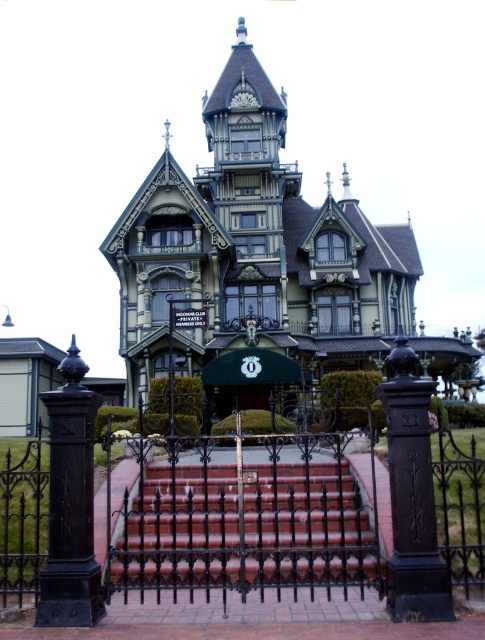
Question: Does green wood mansion at center have a greater width compared to black wrought iron gate at center?

Choices:
 (A) yes
 (B) no

Answer: (A)

Question: Estimate the real-world distances between objects in this image. Which object is farther from the green wood mansion at center?

Choices:
 (A) brick stairs at center
 (B) black cast iron post at center

Answer: (B)

Question: From the image, what is the correct spatial relationship of brick stairs at center in relation to black cast iron post at center?

Choices:
 (A) below
 (B) above

Answer: (A)

Question: Which object appears closest to the camera in this image?

Choices:
 (A) green wood mansion at center
 (B) black cast iron post at center
 (C) green fabric street sign at center

Answer: (B)

Question: Where is brick stairs at center located in relation to black wrought iron post at left in the image?

Choices:
 (A) right
 (B) left

Answer: (A)

Question: Which object is farther from the camera taking this photo?

Choices:
 (A) black cast iron post at center
 (B) green wood mansion at center

Answer: (B)